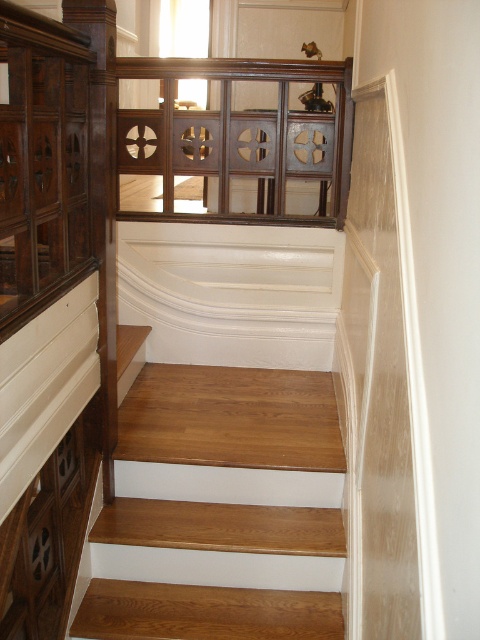
You are a painter who needs to decide which area to paint first. Given that the wooden stairs at center and the dark wood paneling at upper center are both in need of a fresh coat, which one requires more paint due to its size?

The wooden stairs at center requires more paint because it has a larger size compared to the dark wood paneling at upper center.